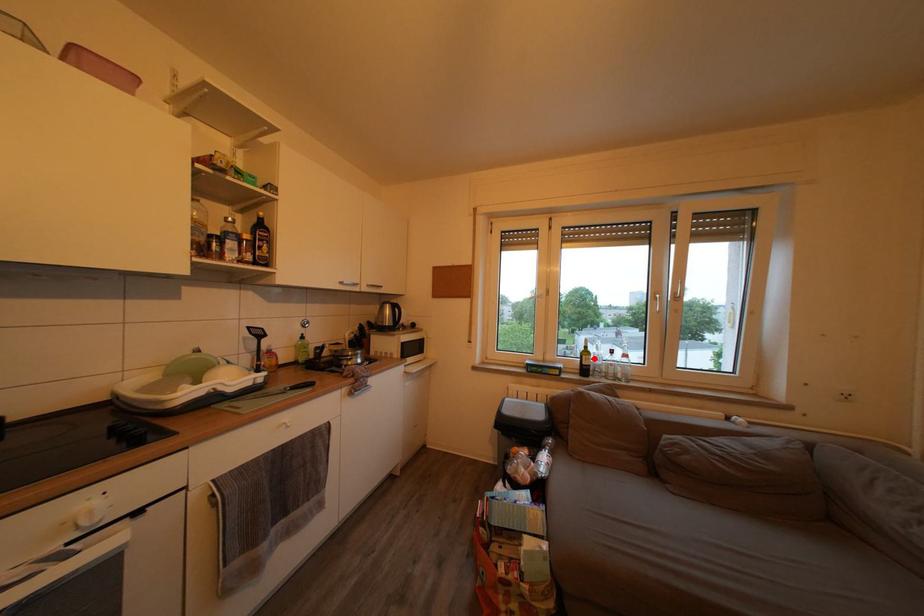
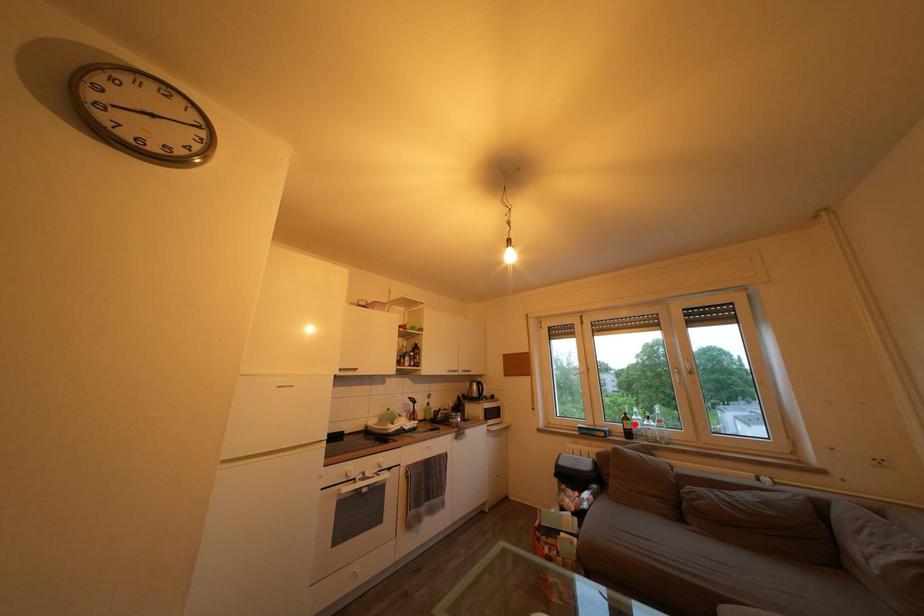
I am providing you with two images of the same scene from different viewpoints. A red point is marked on the first image and another point is marked on the second image. Are the points marked in image1 and image2 representing the same 3D position?

Yes